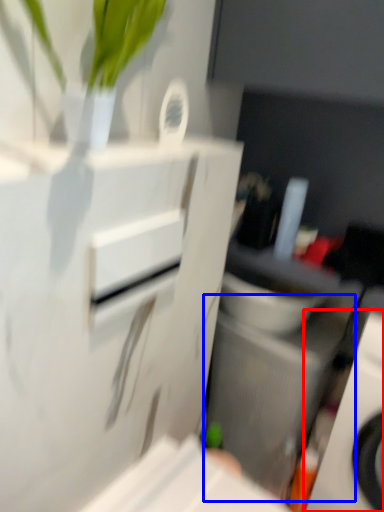
Question: Which object appears farthest to the camera in this image, home appliance (highlighted by a red box) or appliance (highlighted by a blue box)?

Choices:
 (A) home appliance
 (B) appliance

Answer: (B)